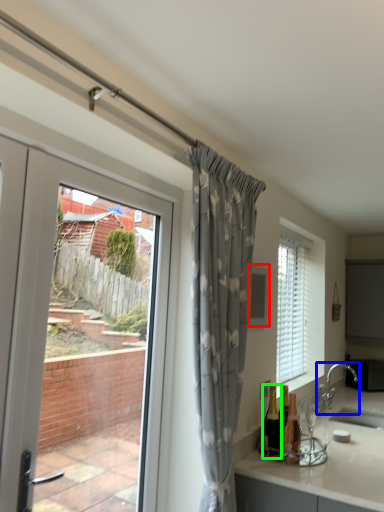
Question: Which is farther away from window screen (highlighted by a red box)? tap (highlighted by a blue box) or bottle (highlighted by a green box)?

Choices:
 (A) tap
 (B) bottle

Answer: (A)